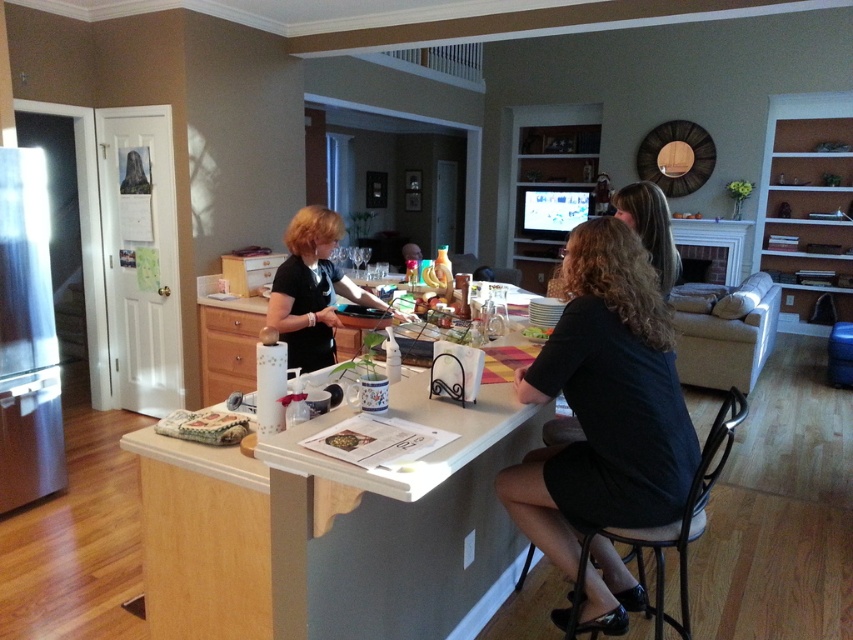
Between beige fabric couch at right and blonde hair at center, which one appears on the left side from the viewer's perspective?

blonde hair at center is more to the left.

Who is higher up, beige fabric couch at right or blonde hair at center?

blonde hair at center is higher up.

Does point (751, 285) lie behind point (639, 198)?

Yes.

Locate an element on the screen. This screenshot has height=640, width=853. beige fabric couch at right is located at coordinates (727, 336).

The image size is (853, 640). What do you see at coordinates (419, 531) in the screenshot?
I see `light brown laminate counter top at center` at bounding box center [419, 531].

Is light brown laminate counter top at center in front of blonde hair at center?

Yes.

Who is more distant from viewer, (x=351, y=547) or (x=660, y=204)?

Positioned behind is point (x=660, y=204).

In order to click on light brown laminate counter top at center in this screenshot , I will do `click(419, 531)`.

Is black fabric shirt at center shorter than smooth white plate at center?

In fact, black fabric shirt at center may be taller than smooth white plate at center.

Find the location of `black fabric shirt at center`. black fabric shirt at center is located at coordinates (604, 403).

The width and height of the screenshot is (853, 640). I want to click on black fabric shirt at center, so click(x=604, y=403).

The image size is (853, 640). What are the coordinates of `black fabric shirt at center` in the screenshot? It's located at (604, 403).